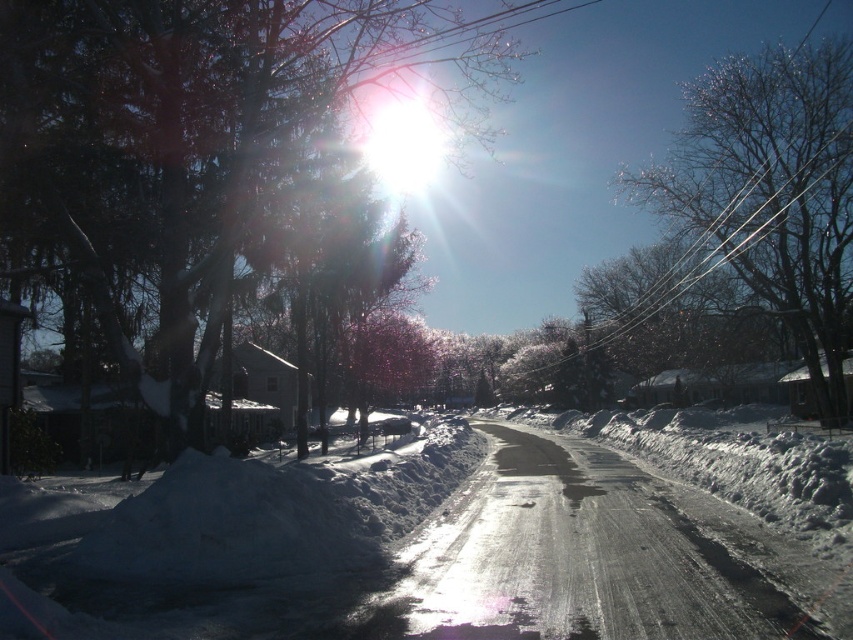
Question: Which of these objects is positioned closest to the white powdery snow at center?

Choices:
 (A) snow-covered tree at upper center
 (B) bare branches at upper right

Answer: (A)

Question: Can you confirm if snow-covered tree at upper center is smaller than bare branches at upper right?

Choices:
 (A) yes
 (B) no

Answer: (B)

Question: Which point is farther from the camera taking this photo?

Choices:
 (A) (306, 67)
 (B) (137, 513)
 (C) (769, 220)

Answer: (C)

Question: Is white powdery snow at center below bare branches at upper right?

Choices:
 (A) no
 (B) yes

Answer: (B)

Question: Does white powdery snow at center have a larger size compared to bare branches at upper right?

Choices:
 (A) no
 (B) yes

Answer: (A)

Question: Which object is closer to the camera taking this photo?

Choices:
 (A) snow-covered tree at upper center
 (B) white powdery snow at center

Answer: (B)